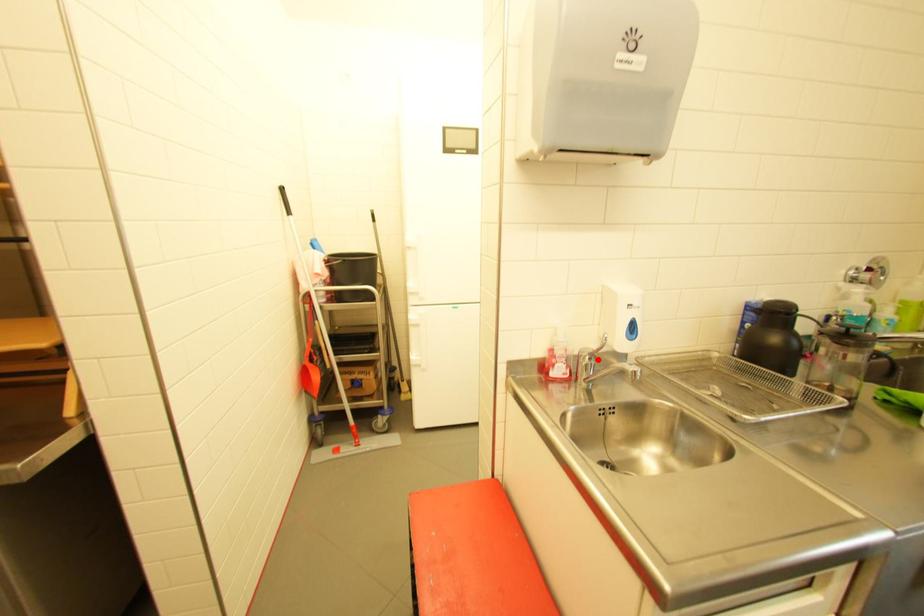
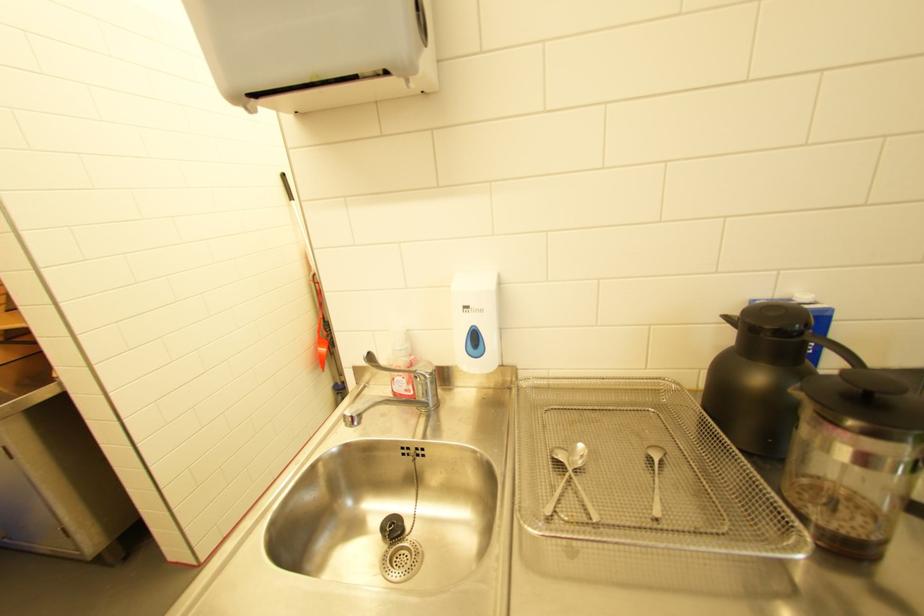
Find the pixel in the second image that matches the highlighted location in the first image.

(423, 378)